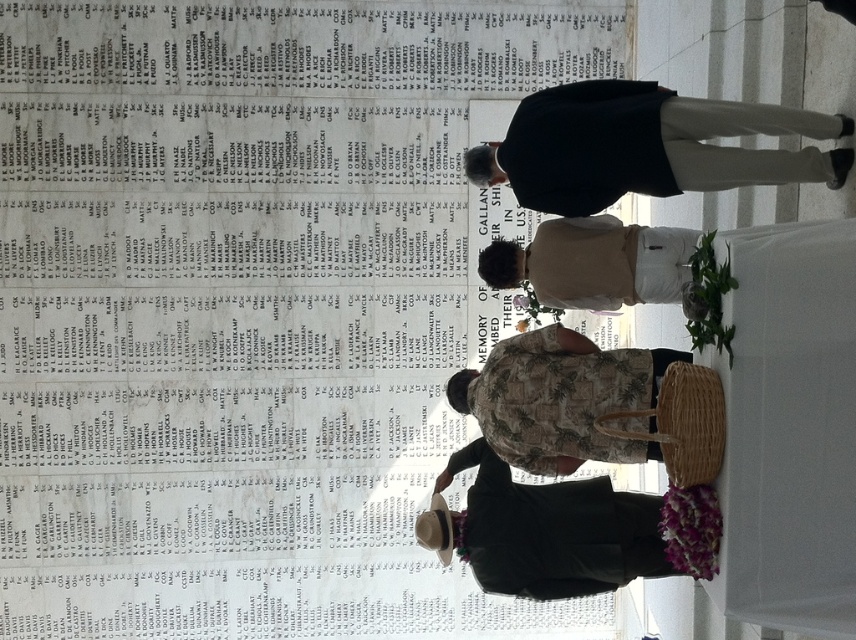
Question: Is white marble wall at upper left wider than beige cotton shirt at center?

Choices:
 (A) no
 (B) yes

Answer: (A)

Question: Is dark blue jacket at center in front of brown woven basket at lower center?

Choices:
 (A) yes
 (B) no

Answer: (A)

Question: Which of the following is the farthest from the observer?

Choices:
 (A) camouflage fabric shirt at center
 (B) dark blue jacket at center
 (C) beige cotton shirt at center

Answer: (C)

Question: Which object is closer to the camera taking this photo?

Choices:
 (A) brown woven basket at lower center
 (B) white marble wall at upper left
 (C) dark blue jacket at center
 (D) camouflage fabric shirt at center

Answer: (C)

Question: Among these points, which one is nearest to the camera?

Choices:
 (A) (242, 84)
 (B) (512, 532)
 (C) (510, 378)
 (D) (672, 246)

Answer: (C)

Question: Is brown woven basket at lower center positioned in front of camouflage fabric shirt at center?

Choices:
 (A) yes
 (B) no

Answer: (B)